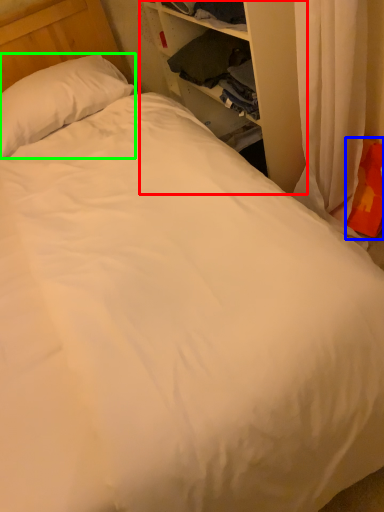
Question: Based on their relative distances, which object is farther from dresser (highlighted by a red box)? Choose from pillow (highlighted by a blue box) and pillow (highlighted by a green box).

Choices:
 (A) pillow
 (B) pillow

Answer: (B)